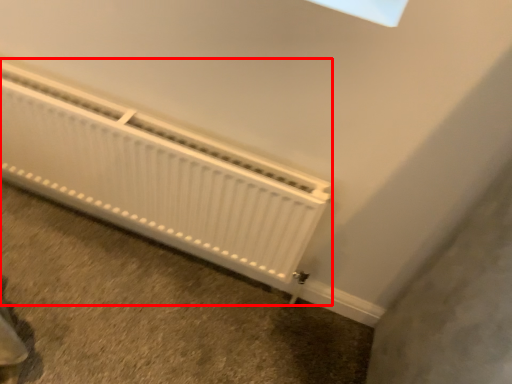
Question: Where is radiator (annotated by the red box) located in relation to concrete in the image?

Choices:
 (A) right
 (B) left

Answer: (A)